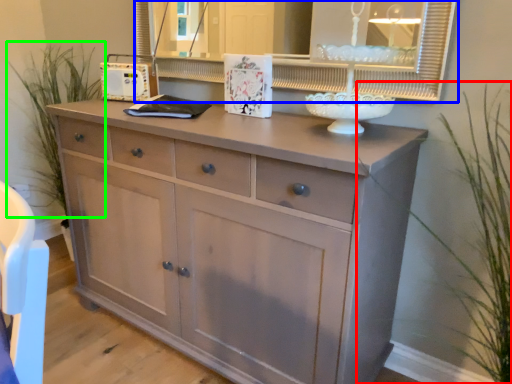
Question: Estimate the real-world distances between objects in this image. Which object is farther from plant (highlighted by a red box), medicine cabinet (highlighted by a blue box) or plant (highlighted by a green box)?

Choices:
 (A) medicine cabinet
 (B) plant

Answer: (B)